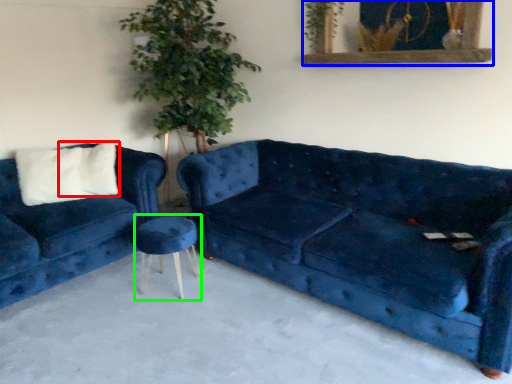
Question: Which object is the farthest from pillow (highlighted by a red box)? Choose among these: picture frame (highlighted by a blue box) or stool (highlighted by a green box).

Choices:
 (A) picture frame
 (B) stool

Answer: (A)